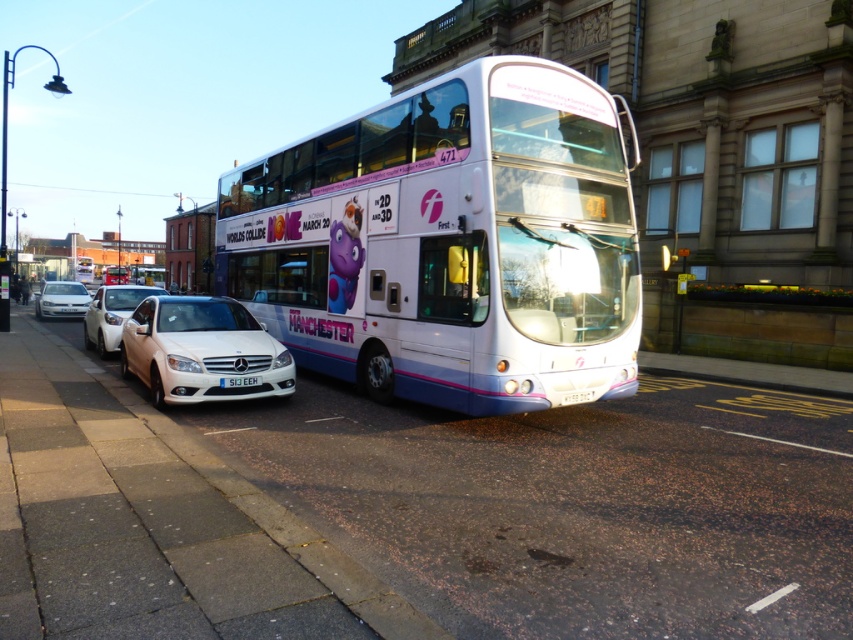
Based on the photo, you are a photographer standing on the sidewalk and want to capture both the white glossy bus at center and the white plastic license plate at center in a single photo. Considering their sizes, which one will appear bigger in the photo?

The white glossy bus at center will appear bigger in the photo because it has a larger size compared to the white plastic license plate at center.

You are standing on the sidewalk and looking at the white double decker bus. There are two points marked on the bus. One is at coordinate point (x=161, y=324) and the other is at point (x=61, y=294). Which point is closer to you?

Point (x=161, y=324) is closer to the camera than point (x=61, y=294).

You are a pedestrian standing on the sidewalk and want to cross the street. The white glossy sedan at left is moving towards you at 15 km per hour. The white glossy bus at center is stationary. If you start crossing the street now, will you be able to reach the other side before the sedan passes by? Assume the street is 10 meters wide and you walk at 1.5 m per hour.

The distance between the white glossy bus at center and the white glossy sedan at left is 6.46 meters. Since the sedan is moving at 15 km per hour and you walk at 1.5 m per hour, it would take you approximately 6.67 minutes to cross the 10 meter street. Meanwhile, the sedan traveling at 15 km per hour converts to 4.17 meters per second. In 6.67 minutes, the sedan would travel 166.65 meters, which is far beyond the 6.46 meter distance between them. Therefore, the sedan would have already passed the bus long